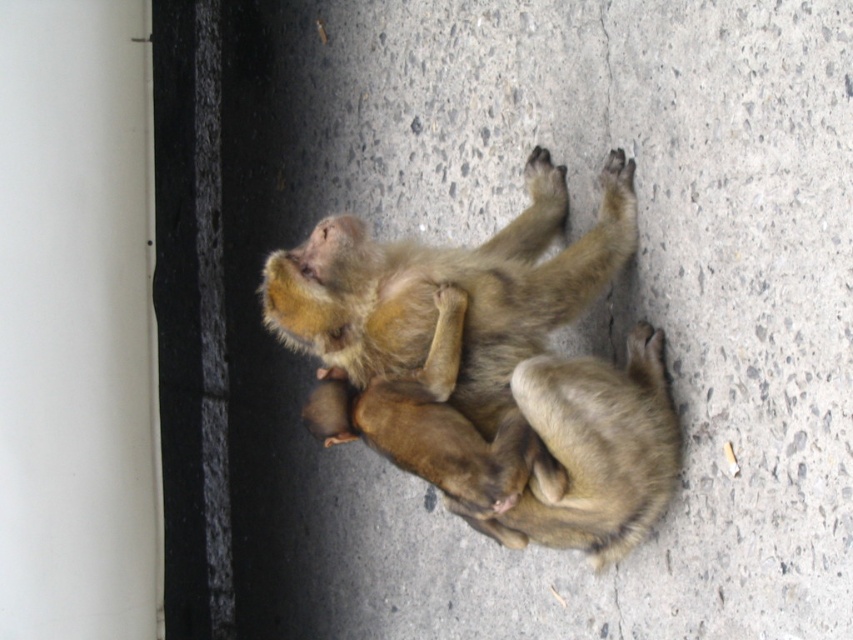
You are a zookeeper observing two monkeys lying on a concrete surface. You notice two points marked on the ground at coordinates point (519, 124) and point (653, 470). Which point is closer to the wall or boundary on the left side of the image?

Point (519, 124) is closer to the wall or boundary on the left side of the image because it is behind point (653, 470), meaning it is positioned farther from the observer and thus nearer to the left boundary.

What is the exact coordinate of the gray concrete at center?

The gray concrete at center is located at point [566,326].

You are a zookeeper observing two monkeys lying on their backs on a concrete surface. You need to determine which monkey is taller. Which one is taller between the golden fur monkey at center and the fuzzy brown monkey at center?

The golden fur monkey at center is taller than the fuzzy brown monkey at center according to the description.